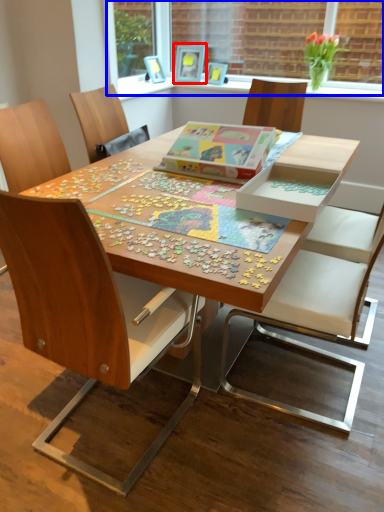
Question: Which object is closer to the camera taking this photo, picture frame (highlighted by a red box) or window screen (highlighted by a blue box)?

Choices:
 (A) picture frame
 (B) window screen

Answer: (B)